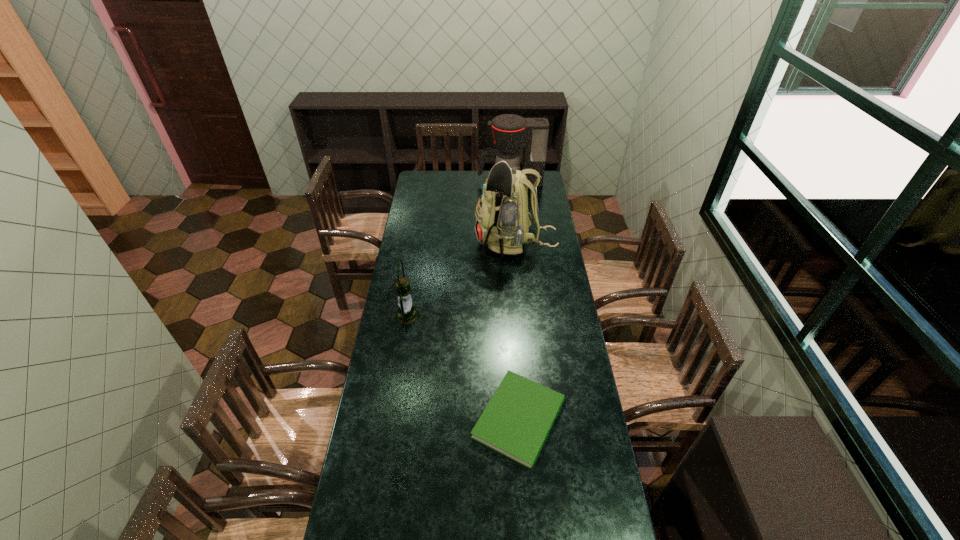
Identify the location of backpack. (502, 222).

I want to click on the third nearest object, so click(x=502, y=222).

Locate an element on the screen. Image resolution: width=960 pixels, height=540 pixels. the farthest object is located at coordinates (510, 132).

Find the location of `the second tallest object`. the second tallest object is located at coordinates (510, 132).

The width and height of the screenshot is (960, 540). What are the coordinates of `the second nearest object` in the screenshot? It's located at (407, 314).

At what (x,y) coordinates should I click in order to perform the action: click on the third tallest object. Please return your answer as a coordinate pair (x, y). Looking at the image, I should click on (407, 314).

Identify the location of paperback book. This screenshot has width=960, height=540. (516, 422).

Locate an element on the screen. The width and height of the screenshot is (960, 540). the nearest object is located at coordinates (516, 422).

Where is `vacant space located on the front-facing side of the backpack`? The width and height of the screenshot is (960, 540). vacant space located on the front-facing side of the backpack is located at coordinates (426, 243).

Locate an element on the screen. The height and width of the screenshot is (540, 960). free spot located on the front-facing side of the backpack is located at coordinates (452, 243).